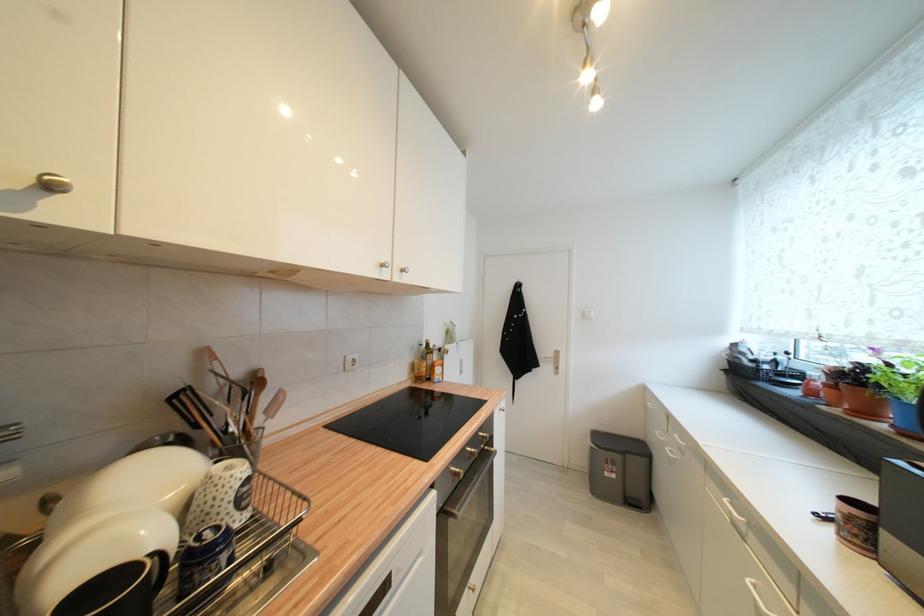
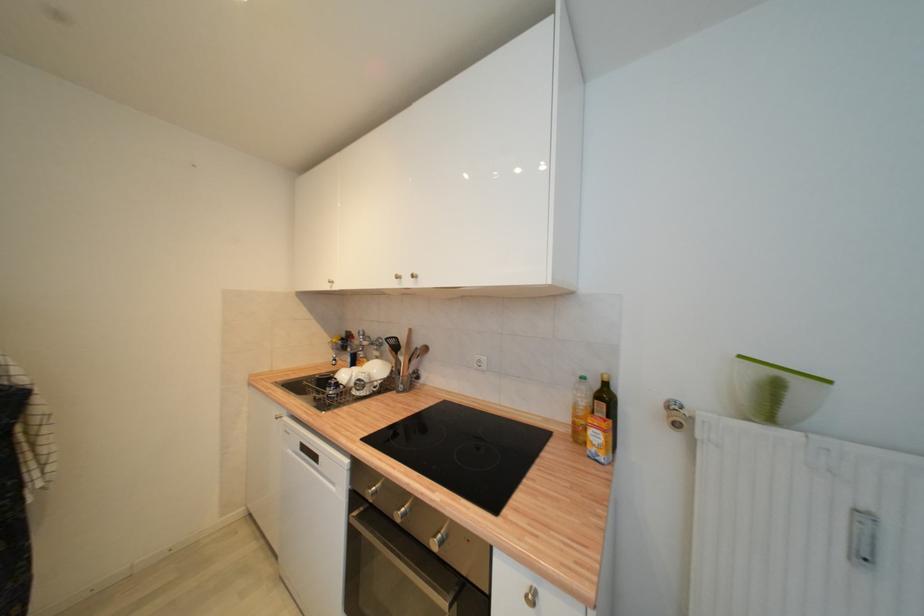
The point at (467,374) is marked in the first image. Where is the corresponding point in the second image?

(869, 560)